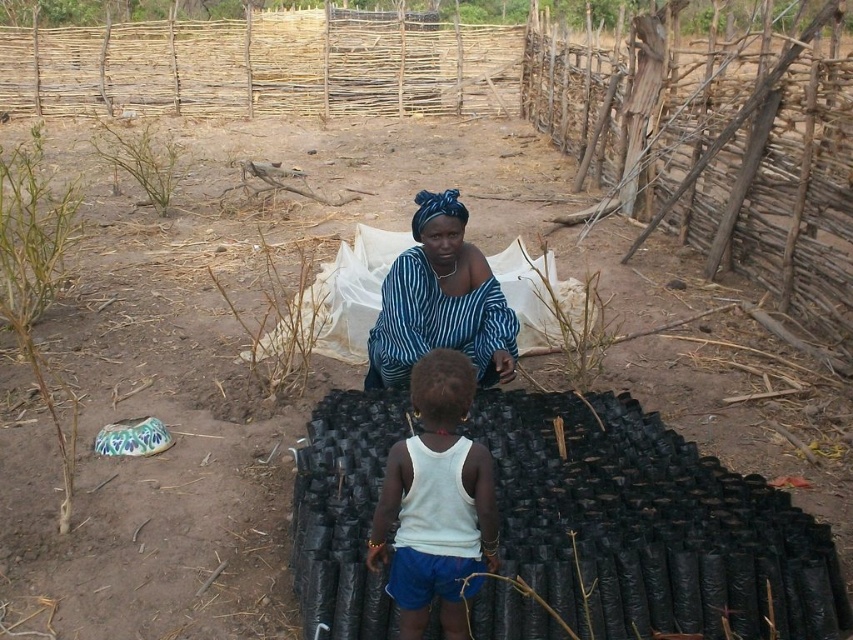
Does white matte tank top at center have a smaller size compared to blue striped fabric at center?

Correct, white matte tank top at center occupies less space than blue striped fabric at center.

Measure the distance between point (413, 365) and camera.

Point (413, 365) is 3.19 meters from camera.

I want to click on white matte tank top at center, so click(436, 500).